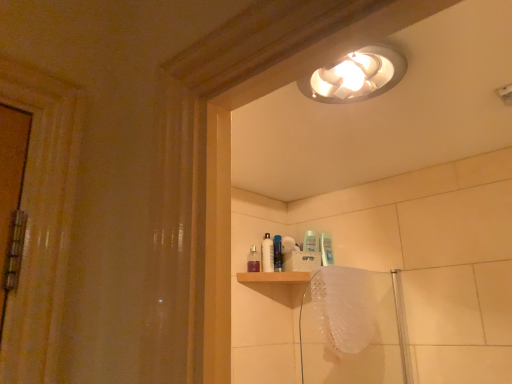
Describe the element at coordinates (253, 260) in the screenshot. I see `translucent plastic spray bottle at upper center, which is the first toiletry in left-to-right order` at that location.

Image resolution: width=512 pixels, height=384 pixels. Find the location of `translucent plastic spray bottle at upper center, which is the first toiletry in left-to-right order`. translucent plastic spray bottle at upper center, which is the first toiletry in left-to-right order is located at coordinates (253, 260).

In terms of height, does translucent plastic bath towel at lower right look taller or shorter compared to translucent plastic shower door at lower right?

In the image, translucent plastic bath towel at lower right appears to be shorter than translucent plastic shower door at lower right.

Is translucent plastic bath towel at lower right aimed at translucent plastic shower door at lower right?

Yes.

How many degrees apart are the facing directions of translucent plastic bath towel at lower right and translucent plastic shower door at lower right?

translucent plastic bath towel at lower right and translucent plastic shower door at lower right are facing 0.00534 degrees away from each other.

Looking at this image, from the image's perspective, which is below, translucent plastic bath towel at lower right or translucent plastic shower door at lower right?

translucent plastic shower door at lower right.

How far apart are blue glossy bottle at center, positioned as the 1th toiletry in right-to-left order, and translucent plastic shower door at lower right?

The distance of blue glossy bottle at center, positioned as the 1th toiletry in right-to-left order, from translucent plastic shower door at lower right is 20.27 inches.

Can you tell me how much blue glossy bottle at center, which ranks as the third toiletry in left-to-right order, and translucent plastic shower door at lower right differ in facing direction?

blue glossy bottle at center, which ranks as the third toiletry in left-to-right order, and translucent plastic shower door at lower right are facing 34.6 degrees away from each other.

Considering the relative sizes of blue glossy bottle at center, which ranks as the third toiletry in left-to-right order, and translucent plastic shower door at lower right in the image provided, is blue glossy bottle at center, which ranks as the third toiletry in left-to-right order, wider than translucent plastic shower door at lower right?

Yes, blue glossy bottle at center, which ranks as the third toiletry in left-to-right order, is wider than translucent plastic shower door at lower right.

Is blue glossy bottle at center, which ranks as the third toiletry in left-to-right order, behind translucent plastic shower door at lower right?

Yes, blue glossy bottle at center, which ranks as the third toiletry in left-to-right order, is further from the camera.

Can you confirm if translucent plastic bath towel at lower right is smaller than blue glossy bottle at center, which ranks as the third toiletry in left-to-right order?

No.

Considering the positions of point (337, 308) and point (278, 271), is point (337, 308) closer or farther from the camera than point (278, 271)?

Clearly, point (337, 308) is closer to the camera than point (278, 271).

Considering the sizes of objects translucent plastic bath towel at lower right and blue glossy bottle at center, which ranks as the third toiletry in left-to-right order, in the image provided, who is taller, translucent plastic bath towel at lower right or blue glossy bottle at center, which ranks as the third toiletry in left-to-right order,?

With more height is translucent plastic bath towel at lower right.

Find the location of `bath towel on the right of white plastic bottle at center, the second toiletry when ordered from left to right`. bath towel on the right of white plastic bottle at center, the second toiletry when ordered from left to right is located at coordinates (344, 307).

Based on the photo, is white plastic bottle at center, which is the 2th toiletry from right to left, oriented away from translucent plastic bath towel at lower right?

No, white plastic bottle at center, which is the 2th toiletry from right to left, is not facing away from translucent plastic bath towel at lower right.

How many degrees apart are the facing directions of white plastic bottle at center, the second toiletry when ordered from left to right, and translucent plastic bath towel at lower right?

25.5 degrees separate the facing orientations of white plastic bottle at center, the second toiletry when ordered from left to right, and translucent plastic bath towel at lower right.

From the image's perspective, is white plastic bottle at center, the second toiletry when ordered from left to right, above or below translucent plastic bath towel at lower right?

white plastic bottle at center, the second toiletry when ordered from left to right, is situated higher than translucent plastic bath towel at lower right in the image.

Considering the relative sizes of blue glossy bottle at center, which ranks as the third toiletry in left-to-right order, and translucent plastic spray bottle at upper center, the third toiletry from the right, in the image provided, is blue glossy bottle at center, which ranks as the third toiletry in left-to-right order, taller than translucent plastic spray bottle at upper center, the third toiletry from the right,?

Yes, blue glossy bottle at center, which ranks as the third toiletry in left-to-right order, is taller than translucent plastic spray bottle at upper center, the third toiletry from the right.

Considering the relative positions of blue glossy bottle at center, which ranks as the third toiletry in left-to-right order, and translucent plastic spray bottle at upper center, which is the first toiletry in left-to-right order, in the image provided, is blue glossy bottle at center, which ranks as the third toiletry in left-to-right order, to the right of translucent plastic spray bottle at upper center, which is the first toiletry in left-to-right order, from the viewer's perspective?

Yes.

From a real-world perspective, which is physically below, blue glossy bottle at center, which ranks as the third toiletry in left-to-right order, or translucent plastic spray bottle at upper center, which is the first toiletry in left-to-right order?

translucent plastic spray bottle at upper center, which is the first toiletry in left-to-right order.

You are a GUI agent. You are given a task and a screenshot of the screen. Output one action in this format:
    pyautogui.click(x=<x>, y=<y>)
    Task: Click on the toiletry that is the 2nd object located above the translucent plastic spray bottle at upper center, which is the first toiletry in left-to-right order (from the image's perspective)
    The width and height of the screenshot is (512, 384).
    Given the screenshot: What is the action you would take?
    pos(278,253)

From the image's perspective, which is above, translucent plastic shower door at lower right or translucent plastic spray bottle at upper center, the third toiletry from the right?

translucent plastic spray bottle at upper center, the third toiletry from the right, appears higher in the image.

From the picture: Is translucent plastic shower door at lower right outside of translucent plastic spray bottle at upper center, the third toiletry from the right?

That's correct, translucent plastic shower door at lower right is outside of translucent plastic spray bottle at upper center, the third toiletry from the right.

How different are the orientations of translucent plastic shower door at lower right and translucent plastic spray bottle at upper center, which is the first toiletry in left-to-right order, in degrees?

The facing directions of translucent plastic shower door at lower right and translucent plastic spray bottle at upper center, which is the first toiletry in left-to-right order, are 41.5 degrees apart.

Does point (330, 282) come farther from viewer compared to point (252, 262)?

No, (330, 282) is in front of (252, 262).

Is white plastic bottle at center, which is the 2th toiletry from right to left, taller than translucent plastic shower door at lower right?

No.

Is white plastic bottle at center, the second toiletry when ordered from left to right, wider than translucent plastic shower door at lower right?

In fact, white plastic bottle at center, the second toiletry when ordered from left to right, might be narrower than translucent plastic shower door at lower right.

Is white plastic bottle at center, which is the 2th toiletry from right to left, aimed at translucent plastic shower door at lower right?

No, white plastic bottle at center, which is the 2th toiletry from right to left, is not turned towards translucent plastic shower door at lower right.

From the image's perspective, which one is positioned lower, white plastic bottle at center, which is the 2th toiletry from right to left, or translucent plastic shower door at lower right?

translucent plastic shower door at lower right appears lower in the image.

At what (x,y) coordinates should I click in order to perform the action: click on bath towel that appears behind the translucent plastic shower door at lower right. Please return your answer as a coordinate pair (x, y). Looking at the image, I should click on (344, 307).

Where is `shower door lying in front of the blue glossy bottle at center, positioned as the 1th toiletry in right-to-left order`? shower door lying in front of the blue glossy bottle at center, positioned as the 1th toiletry in right-to-left order is located at coordinates (353, 328).

Based on their spatial positions, is translucent plastic spray bottle at upper center, which is the first toiletry in left-to-right order, or translucent plastic bath towel at lower right closer to translucent plastic shower door at lower right?

translucent plastic bath towel at lower right is positioned closer to the anchor translucent plastic shower door at lower right.

Which object lies nearer to the anchor point translucent plastic bath towel at lower right, translucent plastic spray bottle at upper center, the third toiletry from the right, or translucent plastic shower door at lower right?

translucent plastic shower door at lower right lies closer to translucent plastic bath towel at lower right than the other object.

When comparing their distances from translucent plastic shower door at lower right, does blue glossy bottle at center, positioned as the 1th toiletry in right-to-left order, or translucent plastic spray bottle at upper center, the third toiletry from the right, seem closer?

Among the two, blue glossy bottle at center, positioned as the 1th toiletry in right-to-left order, is located nearer to translucent plastic shower door at lower right.

From the image, which object appears to be farther from white plastic bottle at center, the second toiletry when ordered from left to right, translucent plastic shower door at lower right or translucent plastic bath towel at lower right?

The object further to white plastic bottle at center, the second toiletry when ordered from left to right, is translucent plastic bath towel at lower right.

From the image, which object appears to be farther from translucent plastic shower door at lower right, translucent plastic spray bottle at upper center, which is the first toiletry in left-to-right order, or blue glossy bottle at center, which ranks as the third toiletry in left-to-right order?

Among the two, translucent plastic spray bottle at upper center, which is the first toiletry in left-to-right order, is located further to translucent plastic shower door at lower right.

In the scene shown: Estimate the real-world distances between objects in this image. Which object is further from white plastic bottle at center, the second toiletry when ordered from left to right, translucent plastic shower door at lower right or translucent plastic spray bottle at upper center, which is the first toiletry in left-to-right order?

translucent plastic shower door at lower right is positioned further to the anchor white plastic bottle at center, the second toiletry when ordered from left to right.

When comparing their distances from blue glossy bottle at center, positioned as the 1th toiletry in right-to-left order, does translucent plastic shower door at lower right or translucent plastic bath towel at lower right seem closer?

translucent plastic shower door at lower right is closer to blue glossy bottle at center, positioned as the 1th toiletry in right-to-left order.

Considering their positions, is translucent plastic bath towel at lower right positioned closer to white plastic bottle at center, which is the 2th toiletry from right to left, than translucent plastic spray bottle at upper center, the third toiletry from the right?

translucent plastic spray bottle at upper center, the third toiletry from the right, is closer to white plastic bottle at center, which is the 2th toiletry from right to left.

Locate an element on the screen. The width and height of the screenshot is (512, 384). bath towel located between translucent plastic shower door at lower right and blue glossy bottle at center, which ranks as the third toiletry in left-to-right order, in the depth direction is located at coordinates (344, 307).

This screenshot has height=384, width=512. Find the location of `toiletry located between translucent plastic bath towel at lower right and blue glossy bottle at center, positioned as the 1th toiletry in right-to-left order, in the depth direction`. toiletry located between translucent plastic bath towel at lower right and blue glossy bottle at center, positioned as the 1th toiletry in right-to-left order, in the depth direction is located at coordinates (253, 260).

The image size is (512, 384). What are the coordinates of `toiletry between translucent plastic shower door at lower right and blue glossy bottle at center, positioned as the 1th toiletry in right-to-left order, in the front-back direction` in the screenshot? It's located at (253, 260).

Locate an element on the screen. Image resolution: width=512 pixels, height=384 pixels. toiletry situated between translucent plastic spray bottle at upper center, the third toiletry from the right, and blue glossy bottle at center, positioned as the 1th toiletry in right-to-left order, from left to right is located at coordinates (267, 254).